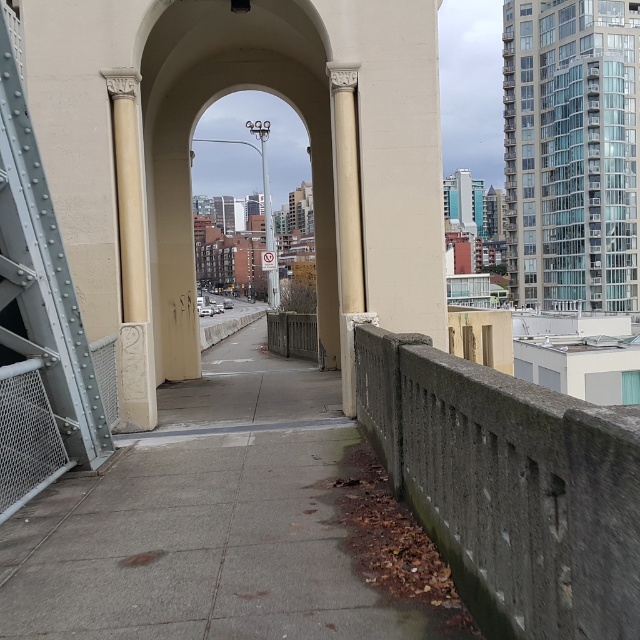
Question: Does gray concrete pavement at center have a smaller size compared to white stone column at left?

Choices:
 (A) no
 (B) yes

Answer: (A)

Question: Is gray concrete pavement at center wider than white marble column at center?

Choices:
 (A) yes
 (B) no

Answer: (A)

Question: Which is farther from the white stone column at left?

Choices:
 (A) gray concrete pavement at center
 (B) white marble column at center

Answer: (B)

Question: Among these points, which one is farthest from the camera?

Choices:
 (A) (124, 275)
 (B) (241, 522)
 (C) (356, 300)

Answer: (C)

Question: Considering the real-world distances, which object is farthest from the white stone column at left?

Choices:
 (A) white marble column at center
 (B) gray concrete pavement at center

Answer: (A)

Question: Is white stone column at left behind white marble column at center?

Choices:
 (A) yes
 (B) no

Answer: (B)